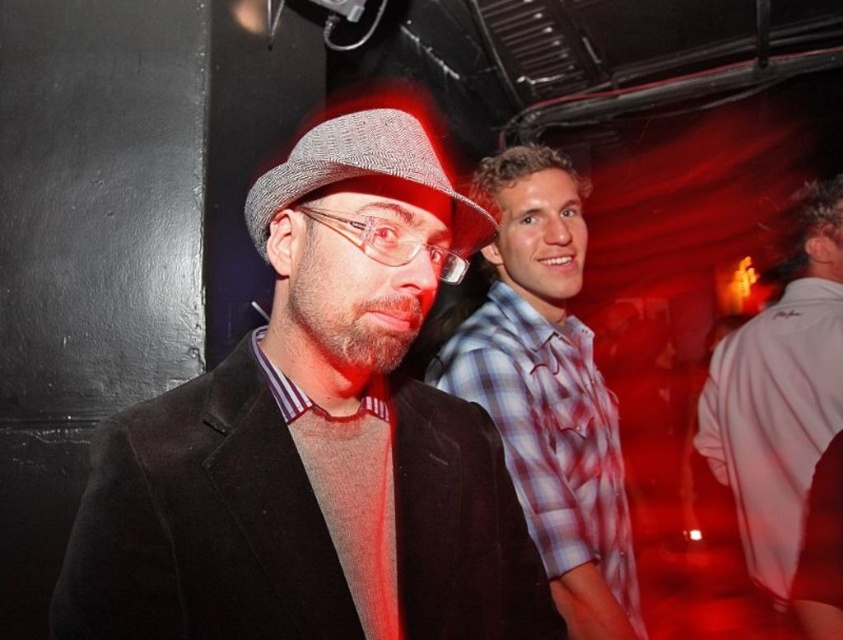
You are at a party and see two shirts in the image. The plaid cotton shirt at center and the white cotton shirt at right. Which one is positioned more to the left?

The plaid cotton shirt at center is positioned more to the left than the white cotton shirt at right.

What is located at the coordinates point (782, 413)?

The white cotton shirt at right is located at point (782, 413).

You are a photographer at the event and need to frame a shot that includes both the matte black suit at center and the herringbone fabric fedora at center. Which object should you adjust your camera angle to prioritize if you want to ensure the wider object is fully in the frame?

The matte black suit at center has a larger width than the herringbone fabric fedora at center, so you should prioritize framing the matte black suit at center to ensure the wider object is fully in the frame.